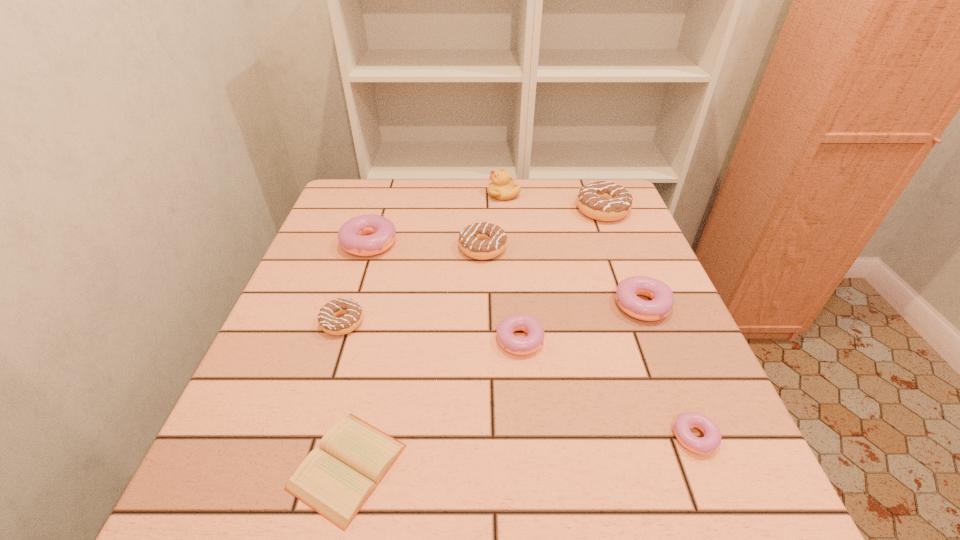
Locate an element on the screen. empty space between the second chocolate doughnut from left to right and the rightmost chocolate doughnut is located at coordinates (542, 230).

The image size is (960, 540). I want to click on free space between the biggest chocolate doughnut and the second purple doughnut from left to right, so click(x=562, y=275).

You are a GUI agent. You are given a task and a screenshot of the screen. Output one action in this format:
    pyautogui.click(x=<x>, y=<y>)
    Task: Click on the free space between the third smallest purple doughnut and the shortest object
    The width and height of the screenshot is (960, 540).
    Given the screenshot: What is the action you would take?
    pyautogui.click(x=496, y=388)

Identify the location of free space between the diary and the yellow duckling. The width and height of the screenshot is (960, 540). (425, 330).

Locate an element on the screen. The width and height of the screenshot is (960, 540). vacant area that lies between the third purple doughnut from right to left and the diary is located at coordinates (434, 404).

Locate an element on the screen. unoccupied area between the biggest chocolate doughnut and the second chocolate doughnut from left to right is located at coordinates (542, 230).

The image size is (960, 540). Find the location of `free spot between the biggest purple doughnut and the second smallest purple doughnut`. free spot between the biggest purple doughnut and the second smallest purple doughnut is located at coordinates (445, 290).

I want to click on free point between the third purple doughnut from right to left and the rightmost chocolate doughnut, so click(562, 275).

Identify the location of vacant area that lies between the diary and the tallest object. Image resolution: width=960 pixels, height=540 pixels. (425, 330).

Locate an element on the screen. object identified as the fourth closest to the biggest chocolate doughnut is located at coordinates (508, 341).